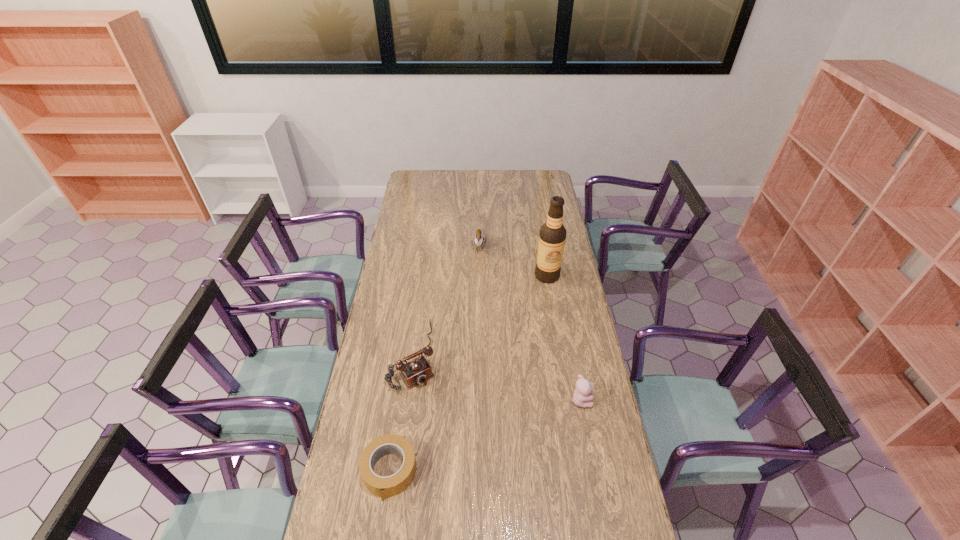
The height and width of the screenshot is (540, 960). In order to click on vacant space situated on the label of the alcohol in this screenshot , I will do `click(539, 303)`.

Locate an element on the screen. This screenshot has width=960, height=540. free space located 0.060m on the label of the alcohol is located at coordinates (541, 293).

The image size is (960, 540). What are the coordinates of `free space located on the dial of the telephone` in the screenshot? It's located at (463, 453).

Locate an element on the screen. The width and height of the screenshot is (960, 540). free space located on the dial of the telephone is located at coordinates pos(449,432).

What are the coordinates of `vacant space located 0.220m on the dial of the telephone` in the screenshot? It's located at (450, 435).

The image size is (960, 540). In order to click on vacant space located at the face of the bird in this screenshot , I will do `click(477, 288)`.

Locate an element on the screen. The height and width of the screenshot is (540, 960). vacant space located at the face of the bird is located at coordinates (477, 288).

Find the location of a particular element. free space located 0.300m at the face of the bird is located at coordinates (476, 305).

You are a GUI agent. You are given a task and a screenshot of the screen. Output one action in this format:
    pyautogui.click(x=<x>, y=<y>)
    Task: Click on the duct tape that is at the left edge
    The image size is (960, 540).
    Given the screenshot: What is the action you would take?
    pyautogui.click(x=392, y=485)

Find the location of a particular element. This screenshot has width=960, height=540. telephone that is at the left edge is located at coordinates (417, 371).